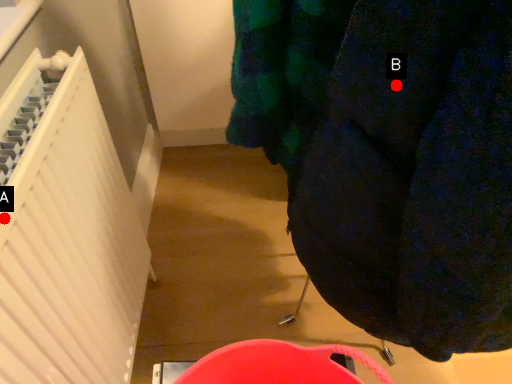
Question: Two points are circled on the image, labeled by A and B beside each circle. Which point is farther from the camera taking this photo?

Choices:
 (A) A is further
 (B) B is further

Answer: (A)